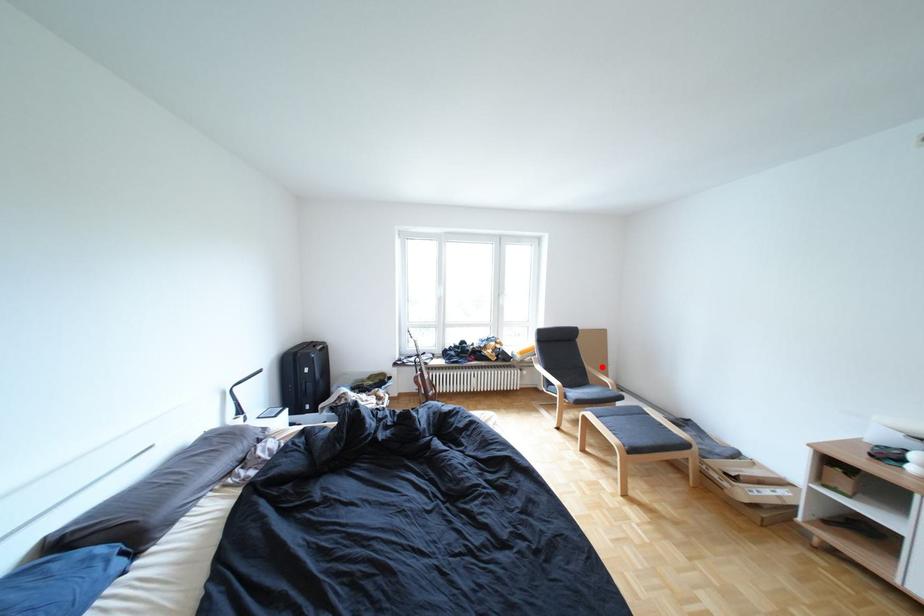
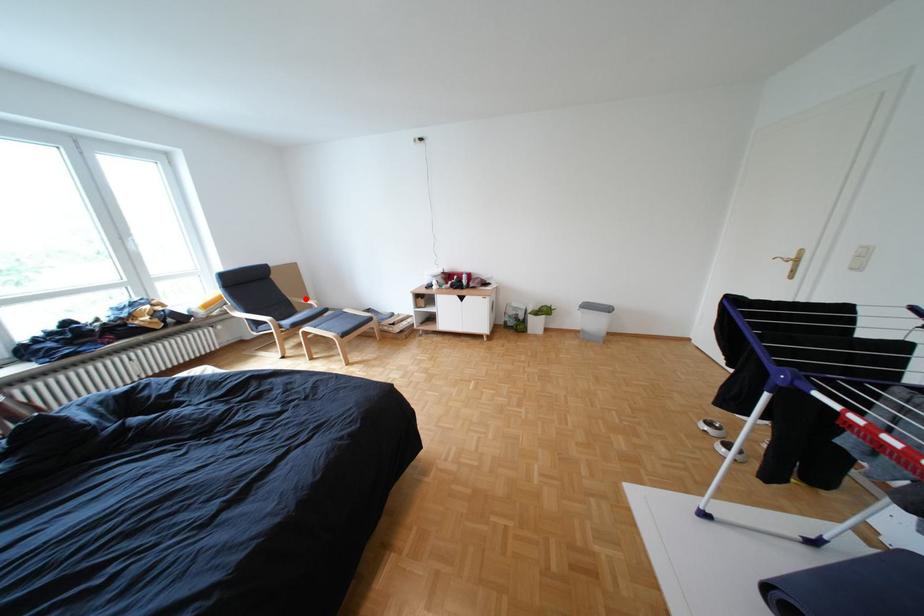
I am providing you with two images of the same scene from different viewpoints. A red point is marked on the first image and another point is marked on the second image. Does the point marked in image1 correspond to the same location as the one in image2?

Yes